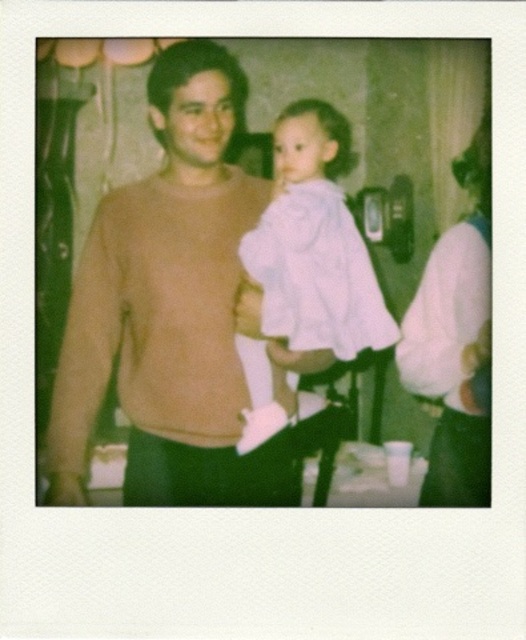
You are organizing a charity event and need to determine if the brown sweater at center and the white fabric dress at right can fit side by side on a display rack that is 1.2 meters wide. Based on their widths, will they both fit?

The brown sweater at center might be wider than the white fabric dress at right. Since the combined width of both items could exceed 1.2 meters, there is a possibility they might not fit side by side on the display rack.

You are standing in the room depicted in the Polaroid photo and want to hand a small gift to the child in the light pink outfit. The gift is placed at the point marked by coordinates point (313, 248). Can you determine if the gift is within reach of the child?

The point (313, 248) indicates the location of the white soft fabric dress at center. Since the child in the light pink outfit is positioned at center, the gift is within reach of the child.